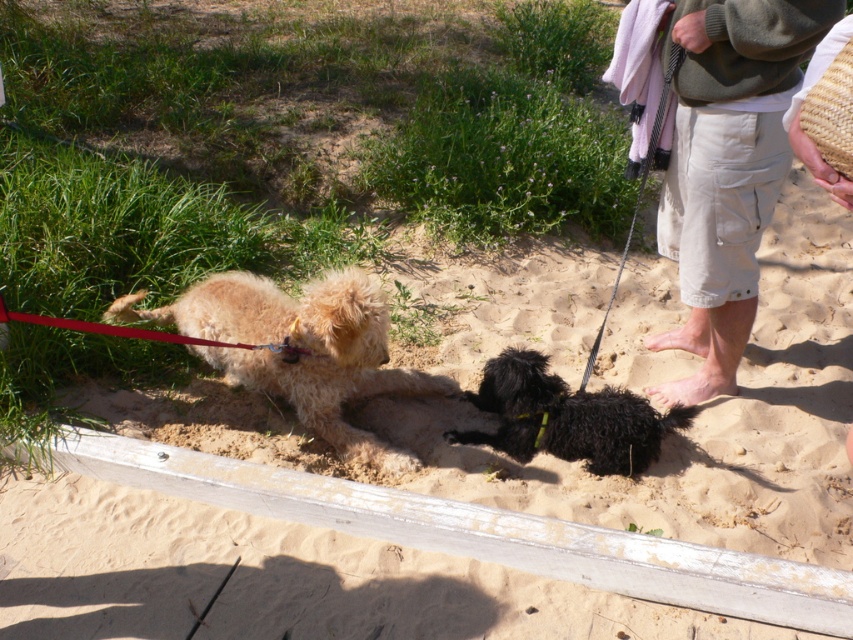
Question: Considering the relative positions of fuzzy golden dog at center and black fuzzy dog at center in the image provided, where is fuzzy golden dog at center located with respect to black fuzzy dog at center?

Choices:
 (A) left
 (B) right

Answer: (A)

Question: Does sandy yellow sand at center appear on the right side of black fuzzy dog at center?

Choices:
 (A) no
 (B) yes

Answer: (B)

Question: Which of these objects is positioned farthest from the black fuzzy dog at center?

Choices:
 (A) fuzzy golden dog at center
 (B) beige cotton shorts at right
 (C) sandy yellow sand at center

Answer: (B)

Question: Which object is closer to the camera taking this photo?

Choices:
 (A) fuzzy golden dog at center
 (B) sandy yellow sand at center
 (C) beige cotton shorts at right

Answer: (C)

Question: Is the position of sandy yellow sand at center less distant than that of beige cotton shorts at right?

Choices:
 (A) yes
 (B) no

Answer: (B)

Question: Which is nearer to the fuzzy golden dog at center?

Choices:
 (A) black fuzzy dog at center
 (B) beige cotton shorts at right

Answer: (A)